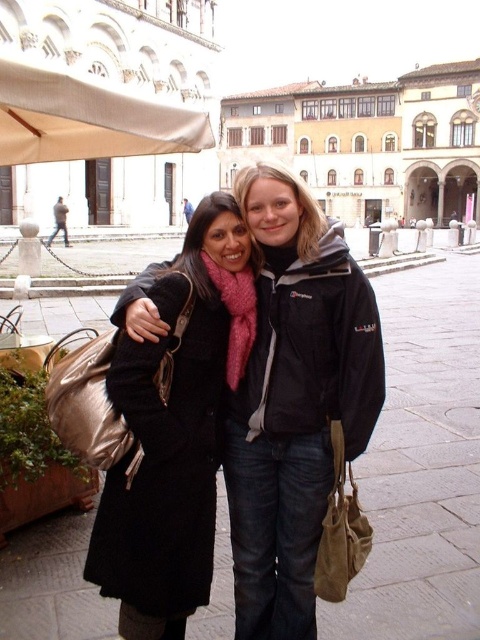
Can you confirm if black wool coat at center is bigger than beige fabric canopy at upper left?

Yes, black wool coat at center is bigger than beige fabric canopy at upper left.

Is black wool coat at center above beige fabric canopy at upper left?

No, black wool coat at center is not above beige fabric canopy at upper left.

Between point (186, 570) and point (135, 97), which one is positioned behind?

The point (135, 97) is more distant.

You are a GUI agent. You are given a task and a screenshot of the screen. Output one action in this format:
    pyautogui.click(x=<x>, y=<y>)
    Task: Click on the black wool coat at center
    This screenshot has width=480, height=640.
    Given the screenshot: What is the action you would take?
    pyautogui.click(x=175, y=433)

The image size is (480, 640). Describe the element at coordinates (295, 401) in the screenshot. I see `black matte jacket at center` at that location.

Is point (276, 292) positioned behind point (22, 156)?

No, it is not.

In order to click on black matte jacket at center in this screenshot , I will do `click(295, 401)`.

Can you confirm if black matte jacket at center is taller than black wool coat at center?

Indeed, black matte jacket at center has a greater height compared to black wool coat at center.

Is black matte jacket at center to the left of black wool coat at center from the viewer's perspective?

No, black matte jacket at center is not to the left of black wool coat at center.

The width and height of the screenshot is (480, 640). I want to click on black matte jacket at center, so click(295, 401).